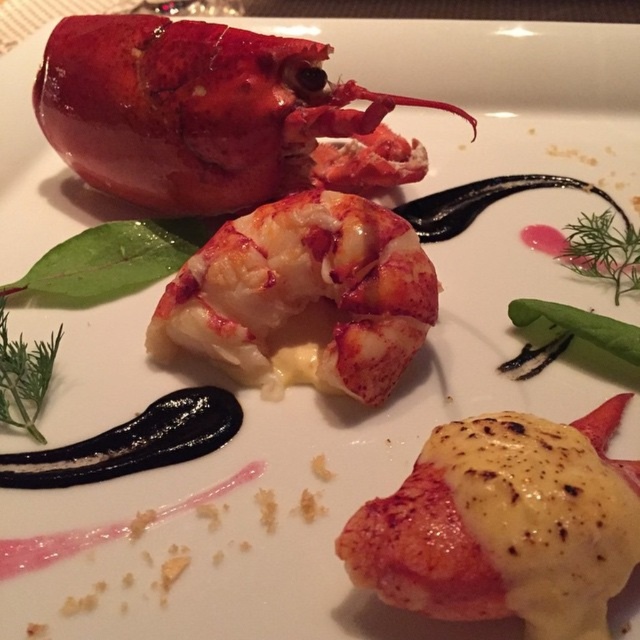
Question: Estimate the real-world distances between objects in this image. Which object is farther from the savory lobster tail at center?

Choices:
 (A) shiny pink lobster at center
 (B) shiny red lobster at upper left

Answer: (B)

Question: Among these points, which one is nearest to the camera?

Choices:
 (A) (260, 81)
 (B) (195, 340)

Answer: (B)

Question: Which object is farther from the camera taking this photo?

Choices:
 (A) shiny red lobster at upper left
 (B) shiny pink lobster at center
 (C) savory lobster tail at center

Answer: (A)

Question: Does shiny red lobster at upper left have a greater width compared to shiny pink lobster at center?

Choices:
 (A) no
 (B) yes

Answer: (B)

Question: Does shiny red lobster at upper left appear on the right side of shiny pink lobster at center?

Choices:
 (A) yes
 (B) no

Answer: (B)

Question: Can you confirm if shiny red lobster at upper left is smaller than shiny pink lobster at center?

Choices:
 (A) no
 (B) yes

Answer: (A)